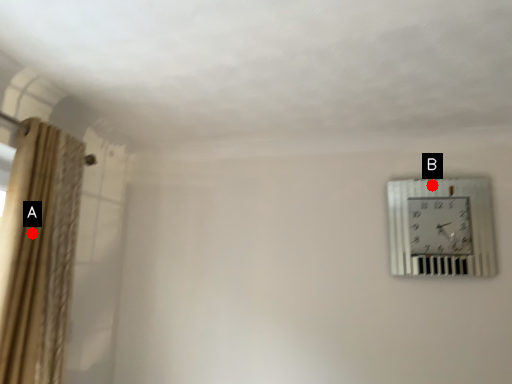
Question: Two points are circled on the image, labeled by A and B beside each circle. Which of the following is the closest to the observer?

Choices:
 (A) A is closer
 (B) B is closer

Answer: (A)